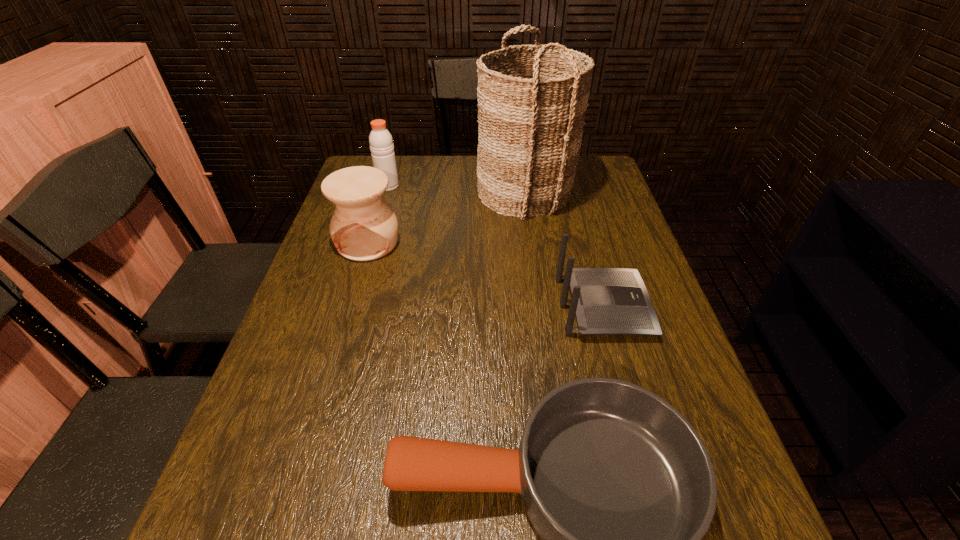
Where is `shaker located at the left edge`? Image resolution: width=960 pixels, height=540 pixels. shaker located at the left edge is located at coordinates (381, 143).

This screenshot has height=540, width=960. I want to click on pottery at the left edge, so click(x=363, y=227).

Identify the location of basket present at the right edge. (531, 105).

Where is `router positioned at the right edge`? router positioned at the right edge is located at coordinates tap(606, 301).

You are a GUI agent. You are given a task and a screenshot of the screen. Output one action in this format:
    pyautogui.click(x=<x>, y=<y>)
    Task: Click on the object present at the far left corner
    The image size is (960, 540).
    Given the screenshot: What is the action you would take?
    pyautogui.click(x=381, y=143)

The height and width of the screenshot is (540, 960). I want to click on object positioned at the far right corner, so click(531, 105).

I want to click on vacant space at the left edge, so click(x=357, y=323).

In the image, there is a desktop. What are the coordinates of `vacant space at the right edge` in the screenshot? It's located at (717, 459).

Where is `vacant region at the far right corner of the desktop`? This screenshot has width=960, height=540. vacant region at the far right corner of the desktop is located at coordinates (594, 179).

What are the coordinates of `empty location between the shaker and the basket` in the screenshot? It's located at pyautogui.click(x=457, y=189).